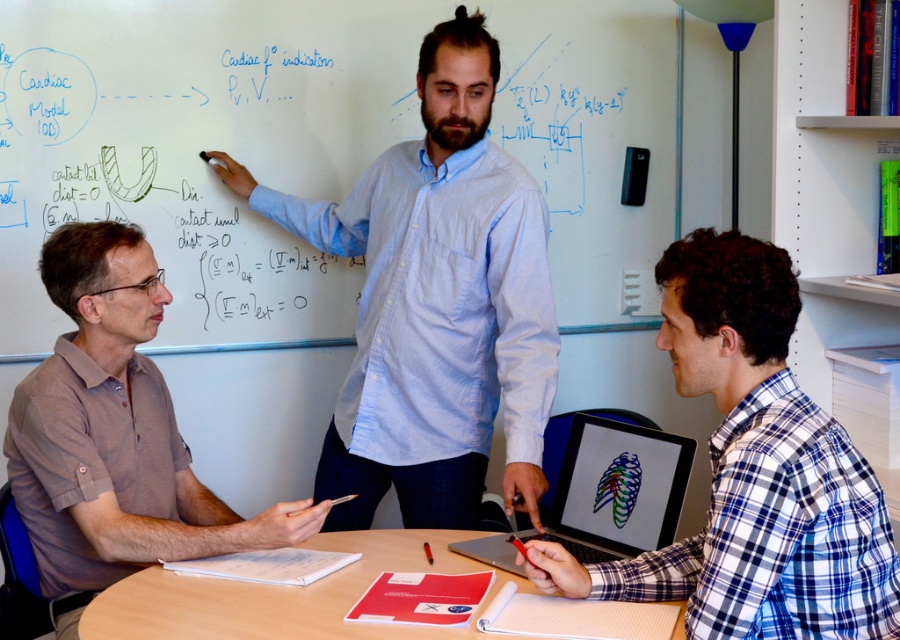
You are a student entering the classroom and see the brown cotton shirt at left and the smooth wooden table at center. Which object is closer to you? Please explain your reasoning based on their positions.

The smooth wooden table at center is behind the brown cotton shirt at left, so the brown cotton shirt at left is closer to you.

You are a student in the classroom and need to locate the blue plaid shirt at center and the brown cotton shirt at left. Which one is positioned lower in the image?

The blue plaid shirt at center is located below the brown cotton shirt at left, so the blue plaid shirt at center is positioned lower in the image.

You are a student sitting at the desk in the classroom and need to write something on the whiteboard at upper center. Can you reach it without moving the matte plastic laptop at center?

The whiteboard at upper center is to the left of the matte plastic laptop at center, so you can reach the whiteboard without moving the laptop since it is positioned to the left of the laptop.